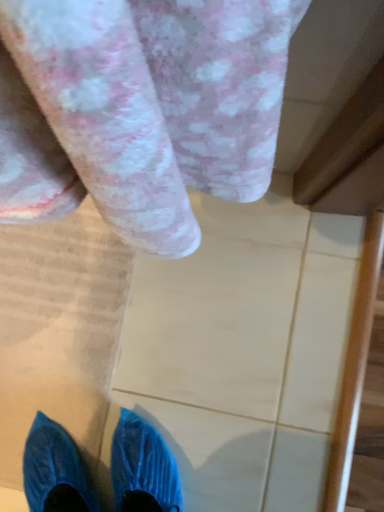
The image size is (384, 512). Describe the element at coordinates (59, 330) in the screenshot. I see `blue plastic bag at lower left` at that location.

Image resolution: width=384 pixels, height=512 pixels. I want to click on blue plastic bag at lower left, so click(x=59, y=330).

Identify the location of blue plastic bag at lower left. The image size is (384, 512). (59, 330).